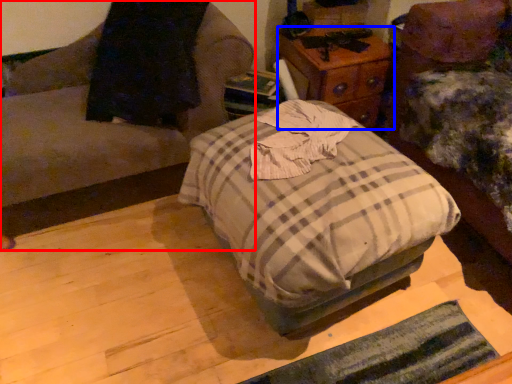
Question: Among these objects, which one is nearest to the camera, furniture (highlighted by a red box) or nightstand (highlighted by a blue box)?

Choices:
 (A) furniture
 (B) nightstand

Answer: (A)